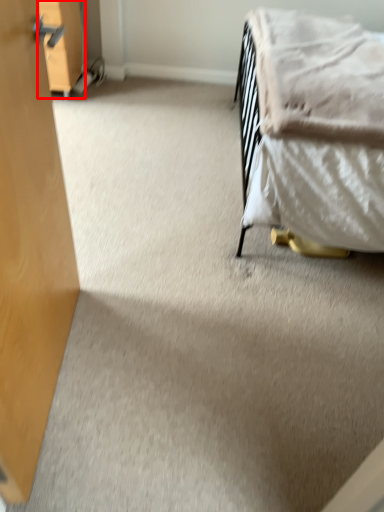
Question: From the image's perspective, what is the correct spatial relationship of drawer (annotated by the red box) in relation to blanket?

Choices:
 (A) below
 (B) above

Answer: (B)